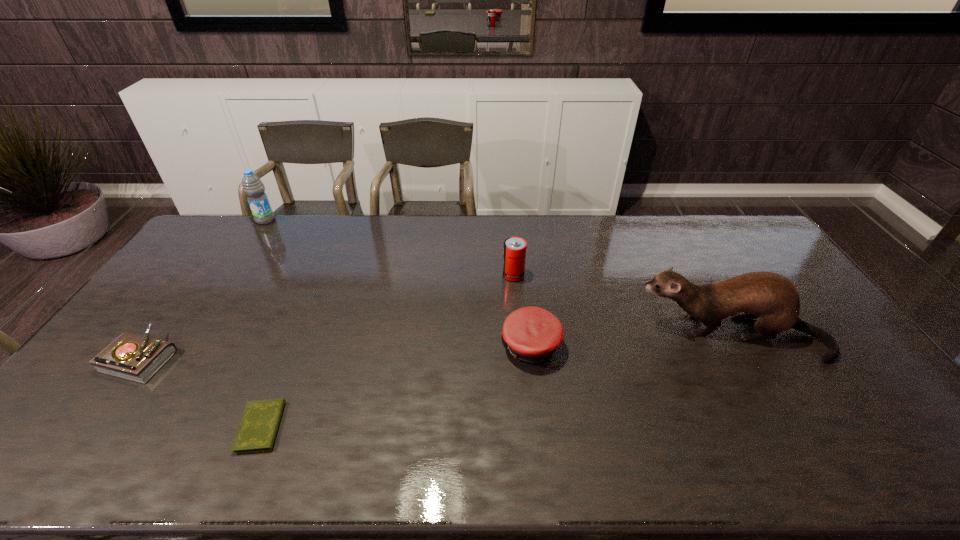
What are the coordinates of `vacant space located at the face of the ferret` in the screenshot? It's located at (612, 335).

Locate an element on the screen. The width and height of the screenshot is (960, 540). vacant area situated 0.350m at the face of the ferret is located at coordinates (518, 335).

Locate an element on the screen. The height and width of the screenshot is (540, 960). free space located 0.130m at the face of the ferret is located at coordinates (594, 335).

Where is `vacant space situated on the front of the second farthest object`? The image size is (960, 540). vacant space situated on the front of the second farthest object is located at coordinates click(x=520, y=353).

Identify the location of free spot located at the front of the cap where the visor is located. (449, 346).

At what (x,y) coordinates should I click in order to perform the action: click on free space located 0.290m at the front of the cap where the visor is located. Please return your answer as a coordinate pair (x, y). This screenshot has height=540, width=960. Looking at the image, I should click on (400, 346).

At what (x,y) coordinates should I click in order to perform the action: click on vacant region located 0.280m at the front of the cap where the visor is located. Please return your answer as a coordinate pair (x, y). Image resolution: width=960 pixels, height=540 pixels. Looking at the image, I should click on (403, 346).

Locate an element on the screen. The width and height of the screenshot is (960, 540). free space located 0.180m on the right of the second shortest object is located at coordinates (239, 357).

The width and height of the screenshot is (960, 540). What are the coordinates of `vacant space located on the right of the shorter diary` in the screenshot? It's located at (422, 427).

Find the location of a particular element. This screenshot has height=540, width=960. object that is at the far edge is located at coordinates (253, 187).